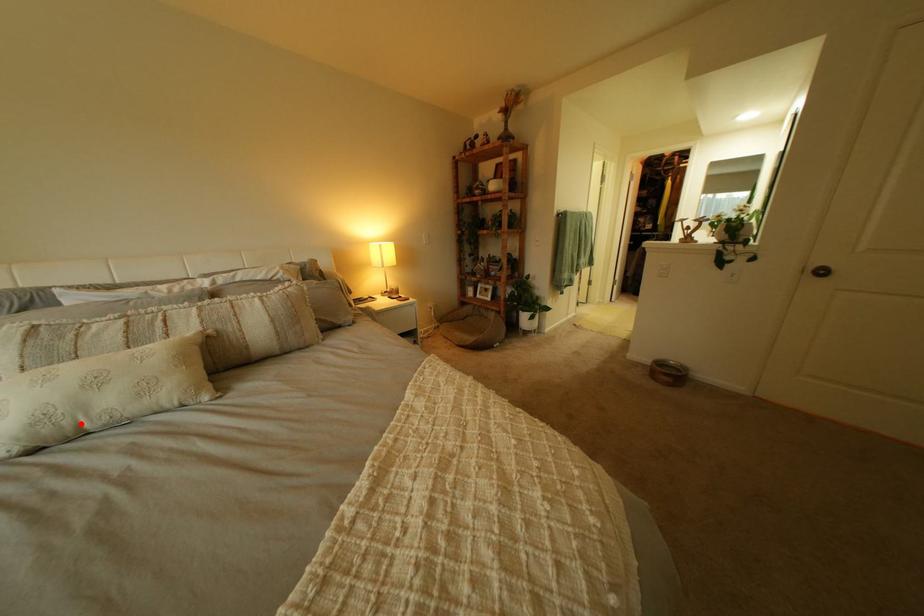
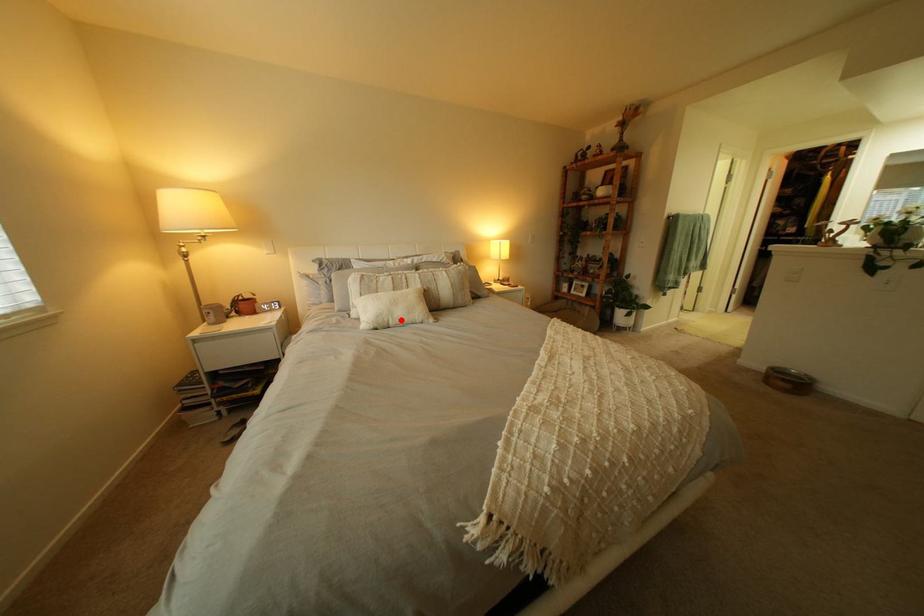
I am providing you with two images of the same scene from different viewpoints. A red point is marked on the first image and another point is marked on the second image. Are the points marked in image1 and image2 representing the same 3D position?

Yes